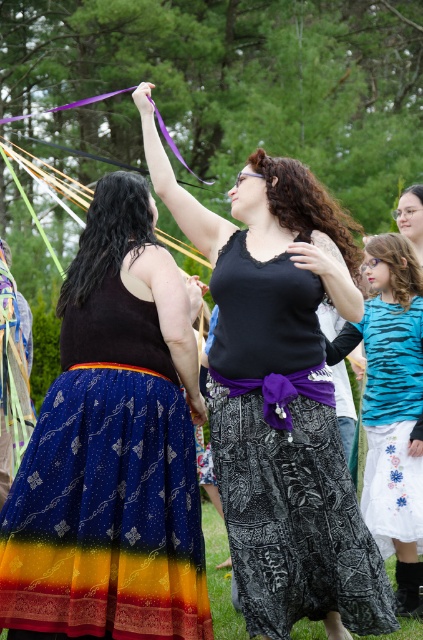
You are standing in the park and see two points marked in the image. Which point, point (139, 604) or point (371, 570), is closer to you?

Point (139, 604) is closer to the viewer than point (371, 570).

You are a photographer trying to capture the perfect shot of the black printed skirt at center. Based on its coordinates, where should you aim your camera?

The black printed skirt at center is located at coordinates point (285, 456), so you should aim your camera at that specific point to capture it.